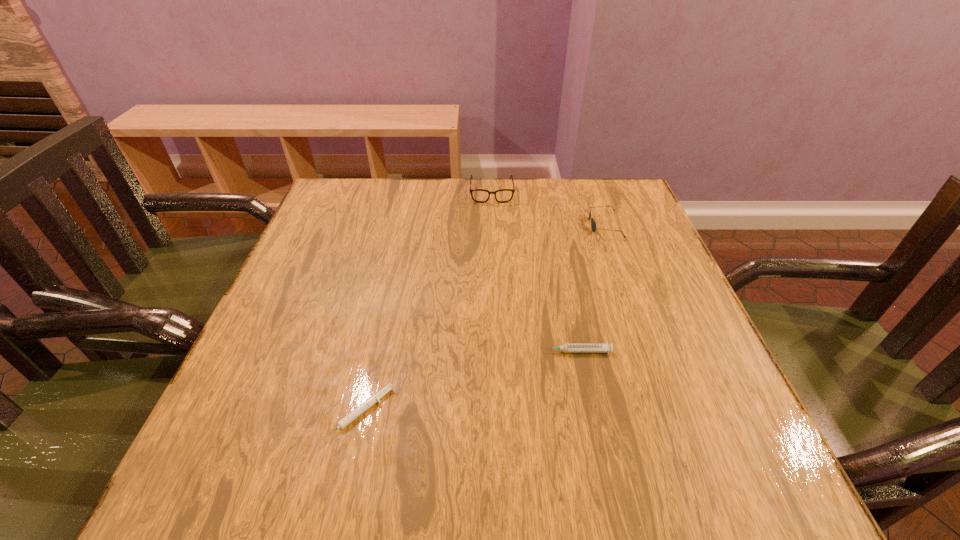
The image size is (960, 540). In order to click on spectacles in this screenshot , I will do `click(478, 195)`.

The height and width of the screenshot is (540, 960). I want to click on the farthest object, so click(x=478, y=195).

The height and width of the screenshot is (540, 960). In order to click on the third shortest object in this screenshot , I will do `click(593, 225)`.

You are a GUI agent. You are given a task and a screenshot of the screen. Output one action in this format:
    pyautogui.click(x=<x>, y=<y>)
    Task: Click on the rightmost object
    The width and height of the screenshot is (960, 540).
    Given the screenshot: What is the action you would take?
    pyautogui.click(x=593, y=225)

Identify the location of the second nearest object. (567, 348).

This screenshot has width=960, height=540. In order to click on the taller syringe in this screenshot , I will do (567, 348).

Locate an element on the screen. The height and width of the screenshot is (540, 960). the nearer syringe is located at coordinates (374, 398).

This screenshot has height=540, width=960. In order to click on the leftmost object in this screenshot , I will do `click(374, 398)`.

At what (x,y) coordinates should I click in order to perform the action: click on vacant area situated on the front-facing side of the spectacles. Please return your answer as a coordinate pair (x, y). Image resolution: width=960 pixels, height=540 pixels. Looking at the image, I should click on (493, 247).

Image resolution: width=960 pixels, height=540 pixels. Find the location of `vacant space located on the lenses of the second farthest object`. vacant space located on the lenses of the second farthest object is located at coordinates (526, 225).